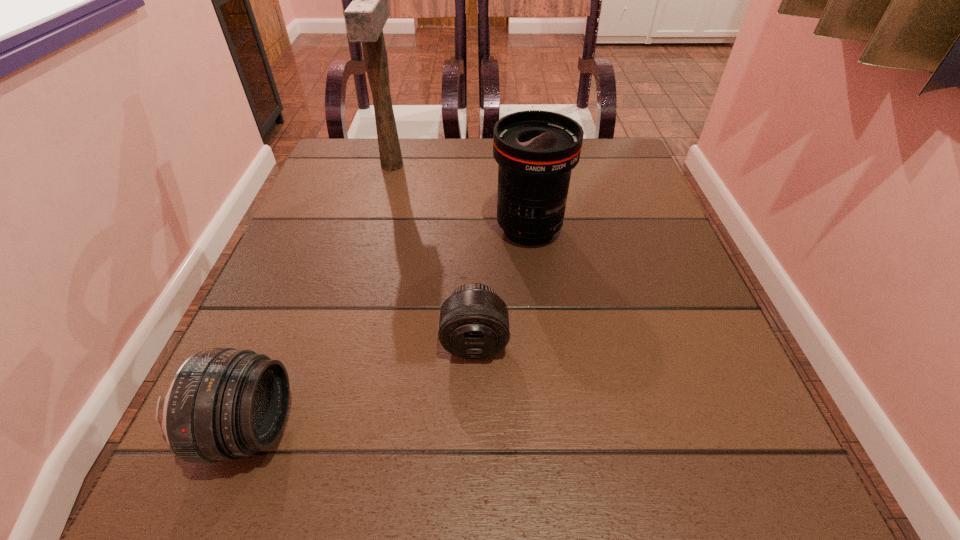
Locate an element on the screen. This screenshot has height=540, width=960. the farthest object is located at coordinates (x=365, y=17).

Find the location of a particular element. This screenshot has height=540, width=960. the tallest object is located at coordinates (365, 17).

Where is `the tallest telephoto lens`? This screenshot has height=540, width=960. the tallest telephoto lens is located at coordinates (536, 150).

You are a GUI agent. You are given a task and a screenshot of the screen. Output one action in this format:
    pyautogui.click(x=<x>, y=<y>)
    Task: Click on the third shortest object
    
    Given the screenshot: What is the action you would take?
    pyautogui.click(x=536, y=150)

The height and width of the screenshot is (540, 960). I want to click on the second tallest telephoto lens, so click(223, 403).

Locate an element on the screen. the nearest telephoto lens is located at coordinates (223, 403).

You are a GUI agent. You are given a task and a screenshot of the screen. Output one action in this format:
    pyautogui.click(x=<x>, y=<y>)
    Task: Click on the shortest telephoto lens
    This screenshot has height=540, width=960.
    Given the screenshot: What is the action you would take?
    pyautogui.click(x=474, y=321)

The width and height of the screenshot is (960, 540). In order to click on the shortest object in this screenshot , I will do `click(474, 321)`.

Locate an element on the screen. vacant space situated 0.220m on the right of the mallet is located at coordinates (492, 165).

The image size is (960, 540). Find the location of `vacant position located on the left of the third shortest object`. vacant position located on the left of the third shortest object is located at coordinates (380, 229).